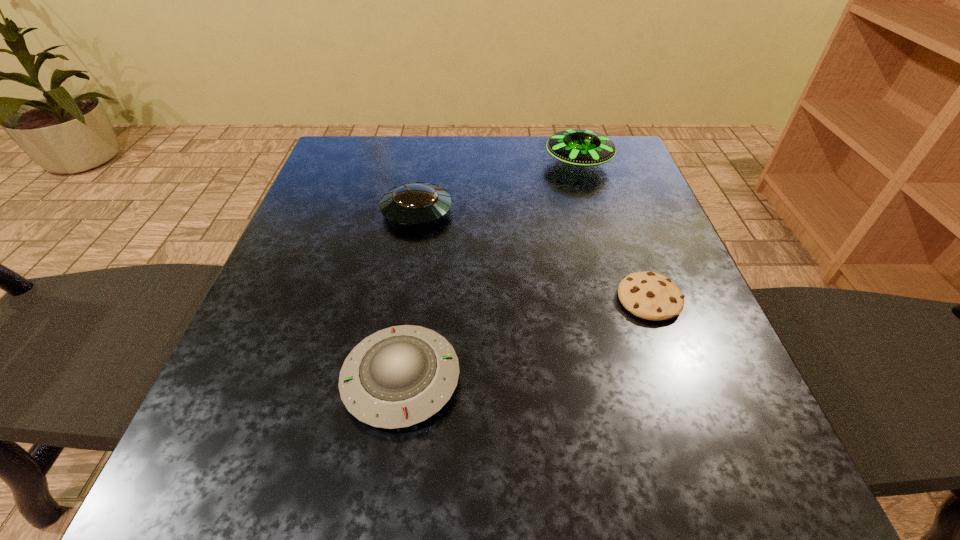
Where is `free space that is in between the shortest object and the tallest saucer`? The width and height of the screenshot is (960, 540). free space that is in between the shortest object and the tallest saucer is located at coordinates (613, 231).

At what (x,y) coordinates should I click in order to perform the action: click on free space between the cookie and the farthest object. Please return your answer as a coordinate pair (x, y). This screenshot has height=540, width=960. Looking at the image, I should click on (613, 231).

You are a GUI agent. You are given a task and a screenshot of the screen. Output one action in this format:
    pyautogui.click(x=<x>, y=<y>)
    Task: Click on the free point between the rightmost saucer and the nearest object
    The width and height of the screenshot is (960, 540).
    Given the screenshot: What is the action you would take?
    pyautogui.click(x=490, y=271)

Where is `free space that is in between the second nearest object and the farthest saucer`? This screenshot has width=960, height=540. free space that is in between the second nearest object and the farthest saucer is located at coordinates (613, 231).

Where is `free spot between the second nearest saucer and the nearest object`? This screenshot has height=540, width=960. free spot between the second nearest saucer and the nearest object is located at coordinates (409, 295).

The width and height of the screenshot is (960, 540). I want to click on empty location between the shortest object and the farthest object, so click(613, 231).

Locate an element on the screen. free space between the third farthest object and the third nearest object is located at coordinates click(x=533, y=255).

The image size is (960, 540). Find the location of `empty space between the second farthest object and the third farthest object`. empty space between the second farthest object and the third farthest object is located at coordinates [x=533, y=255].

You are a GUI agent. You are given a task and a screenshot of the screen. Output one action in this format:
    pyautogui.click(x=<x>, y=<y>)
    Task: Click on the free space that is in between the cookie and the nearest saucer
    
    Given the screenshot: What is the action you would take?
    pyautogui.click(x=525, y=340)

Locate an element on the screen. This screenshot has height=540, width=960. free point between the nearest saucer and the second nearest saucer is located at coordinates (409, 295).